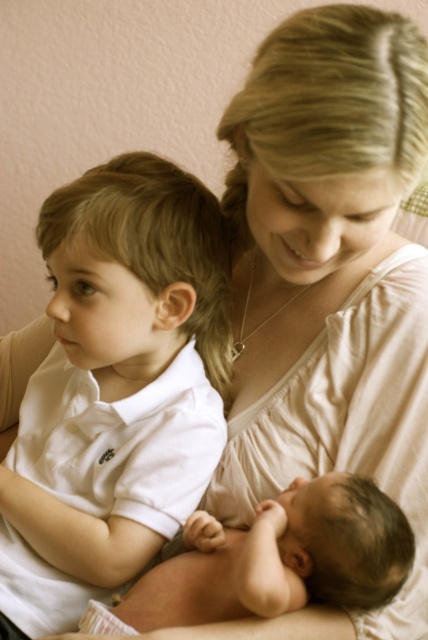
Question: Which point appears farthest from the camera in this image?

Choices:
 (A) (92, 541)
 (B) (180, 611)

Answer: (A)

Question: Can you confirm if white cotton shirt at left is positioned below smooth skin baby at center?

Choices:
 (A) yes
 (B) no

Answer: (B)

Question: Does white cotton shirt at left appear on the left side of smooth skin baby at center?

Choices:
 (A) yes
 (B) no

Answer: (A)

Question: Which of the following is the closest to the observer?

Choices:
 (A) white cotton shirt at left
 (B) smooth skin baby at center

Answer: (B)

Question: Does white cotton shirt at left appear under smooth skin baby at center?

Choices:
 (A) yes
 (B) no

Answer: (B)